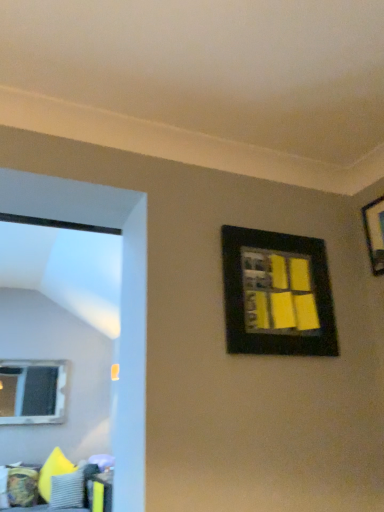
Question: Does gray textured pillow at lower left have a smaller size compared to black matte picture frame at upper right, the first picture frame in the right-to-left sequence?

Choices:
 (A) yes
 (B) no

Answer: (B)

Question: From a real-world perspective, is gray textured pillow at lower left physically below black matte picture frame at upper right, which is the 2th picture frame from left to right?

Choices:
 (A) no
 (B) yes

Answer: (B)

Question: Can we say gray textured pillow at lower left lies outside black matte picture frame at upper right, the first picture frame in the right-to-left sequence?

Choices:
 (A) no
 (B) yes

Answer: (B)

Question: From a real-world perspective, is gray textured pillow at lower left physically above black matte picture frame at upper right, the first picture frame in the right-to-left sequence?

Choices:
 (A) yes
 (B) no

Answer: (B)

Question: Does gray textured pillow at lower left have a greater width compared to black matte picture frame at upper right, which is the 2th picture frame from left to right?

Choices:
 (A) no
 (B) yes

Answer: (B)

Question: Do you think clear glass window at left is within black matte picture frame at upper right, acting as the 1th picture frame starting from the left, or outside of it?

Choices:
 (A) outside
 (B) inside

Answer: (A)

Question: Is point (16, 378) positioned closer to the camera than point (281, 311)?

Choices:
 (A) farther
 (B) closer

Answer: (A)

Question: From the image's perspective, is clear glass window at left located above or below black matte picture frame at upper right, acting as the 1th picture frame starting from the left?

Choices:
 (A) above
 (B) below

Answer: (B)

Question: In terms of size, does clear glass window at left appear bigger or smaller than black matte picture frame at upper right, the 2th picture frame when ordered from right to left?

Choices:
 (A) big
 (B) small

Answer: (A)

Question: In terms of height, does textured fabric couch at lower left look taller or shorter compared to gray textured pillow at lower left?

Choices:
 (A) tall
 (B) short

Answer: (A)

Question: Would you say textured fabric couch at lower left is to the left or to the right of gray textured pillow at lower left in the picture?

Choices:
 (A) right
 (B) left

Answer: (B)

Question: Is point (79, 492) closer or farther from the camera than point (84, 486)?

Choices:
 (A) closer
 (B) farther

Answer: (A)

Question: Looking at their shapes, would you say textured fabric couch at lower left is wider or thinner than gray textured pillow at lower left?

Choices:
 (A) wide
 (B) thin

Answer: (A)

Question: From the image's perspective, is textured fabric couch at lower left positioned above or below black matte picture frame at upper right, the 2th picture frame when ordered from right to left?

Choices:
 (A) above
 (B) below

Answer: (B)

Question: In the image, is textured fabric couch at lower left positioned in front of or behind black matte picture frame at upper right, the 2th picture frame when ordered from right to left?

Choices:
 (A) behind
 (B) front

Answer: (A)